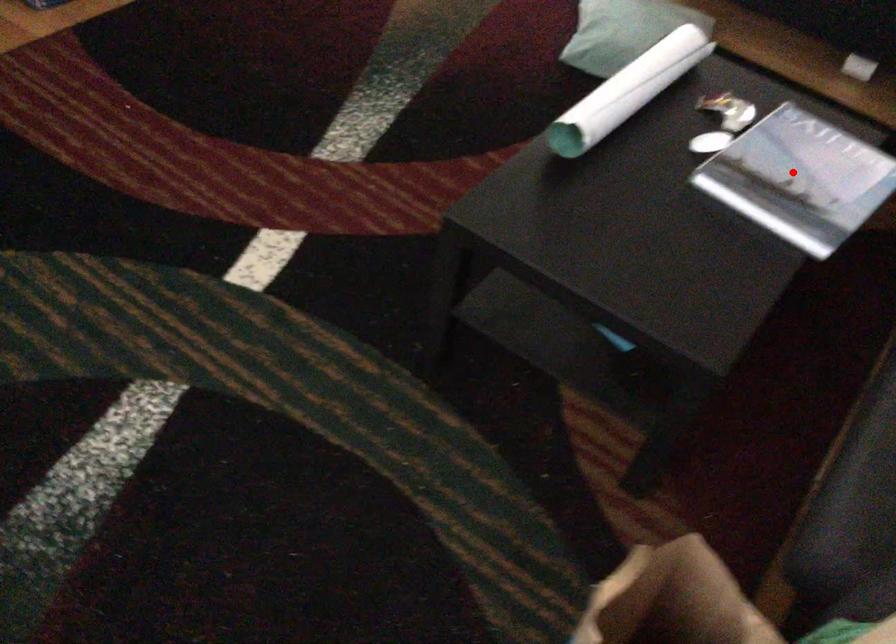
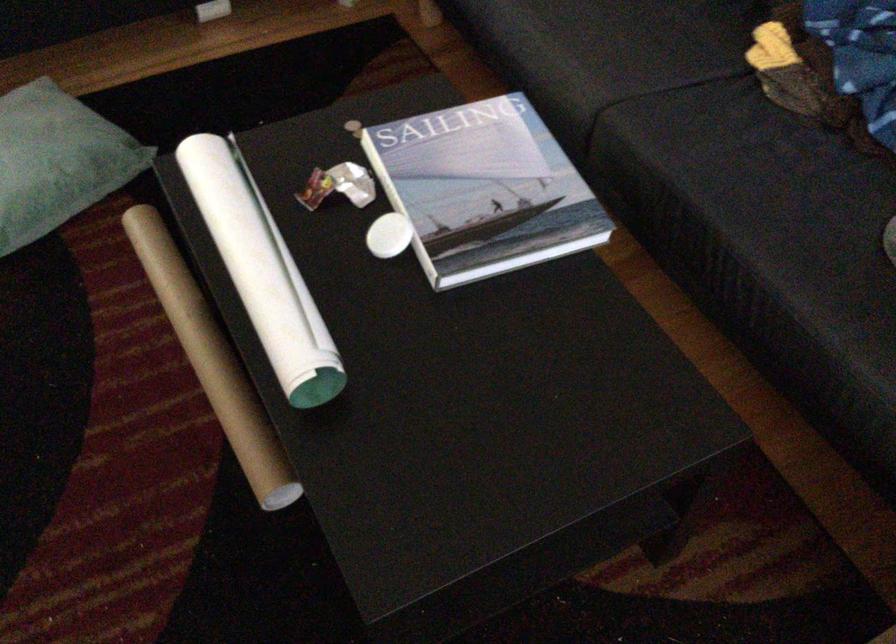
Find the pixel in the second image that matches the highlighted location in the first image.

(484, 190)